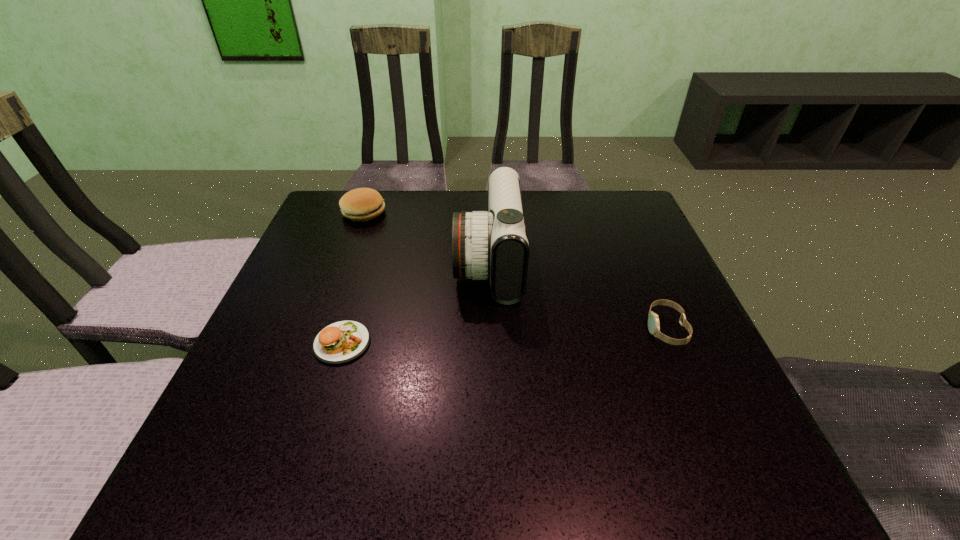
The height and width of the screenshot is (540, 960). Find the location of `free space located on the face of the watch`. free space located on the face of the watch is located at coordinates (612, 329).

Find the location of a particular element. The image size is (960, 540). vacant region located 0.220m on the face of the watch is located at coordinates (537, 329).

Locate an element on the screen. free space located on the face of the watch is located at coordinates (532, 329).

Find the location of a particular element. vacant space located 0.220m on the front of the nearer patty is located at coordinates (298, 487).

Where is `camcorder that is at the far edge`? This screenshot has width=960, height=540. camcorder that is at the far edge is located at coordinates (493, 244).

At what (x,y) coordinates should I click in order to perform the action: click on patty at the far edge. Please return your answer as a coordinate pair (x, y). This screenshot has width=960, height=540. Looking at the image, I should click on (362, 204).

The height and width of the screenshot is (540, 960). What are the coordinates of `object located in the right edge section of the desktop` in the screenshot? It's located at (653, 321).

Find the location of a particular element. Image resolution: width=960 pixels, height=540 pixels. object positioned at the far left corner is located at coordinates (362, 204).

In the image, there is a desktop. Where is `free space at the far edge`? The height and width of the screenshot is (540, 960). free space at the far edge is located at coordinates (534, 215).

Locate an element on the screen. Image resolution: width=960 pixels, height=540 pixels. free space at the near edge of the desktop is located at coordinates (405, 452).